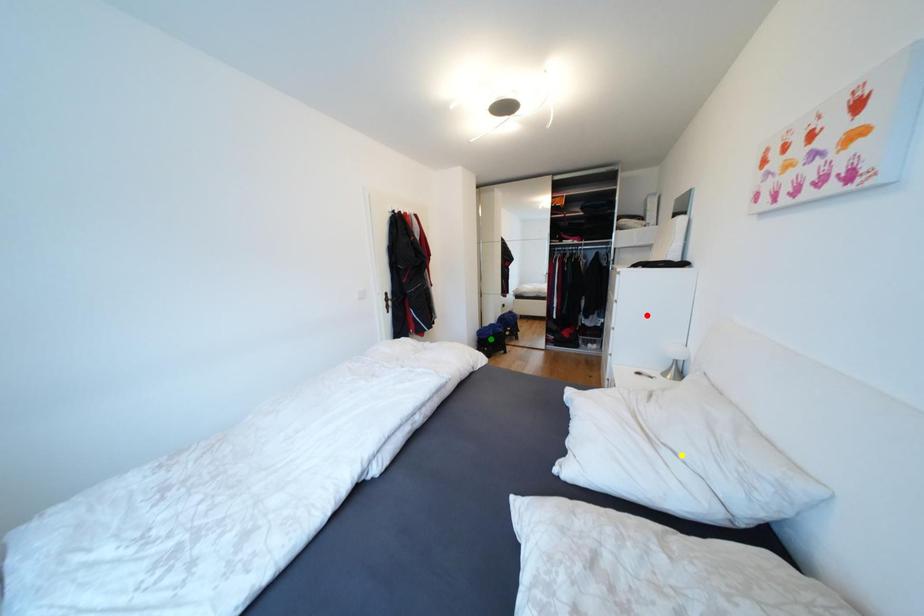
Order these from nearest to farthest:
red point
green point
yellow point

yellow point
green point
red point